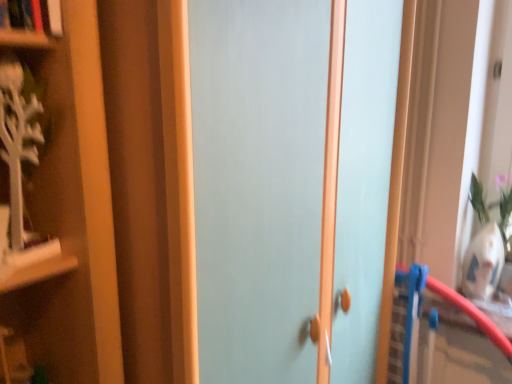
Question: From the image's perspective, is matte light blue door at center beneath hardcover book at upper left?

Choices:
 (A) no
 (B) yes

Answer: (B)

Question: Is matte light blue door at center to the left of hardcover book at upper left from the viewer's perspective?

Choices:
 (A) yes
 (B) no

Answer: (B)

Question: Is matte light blue door at center closer to the viewer compared to hardcover book at upper left?

Choices:
 (A) no
 (B) yes

Answer: (B)

Question: From a real-world perspective, is matte light blue door at center beneath hardcover book at upper left?

Choices:
 (A) yes
 (B) no

Answer: (A)

Question: Are matte light blue door at center and hardcover book at upper left beside each other?

Choices:
 (A) no
 (B) yes

Answer: (A)

Question: Does matte light blue door at center have a lesser height compared to hardcover book at upper left?

Choices:
 (A) no
 (B) yes

Answer: (A)

Question: Is hardcover book at upper left shorter than matte light blue door at center?

Choices:
 (A) no
 (B) yes

Answer: (B)

Question: Is hardcover book at upper left positioned behind matte light blue door at center?

Choices:
 (A) no
 (B) yes

Answer: (B)

Question: From the image's perspective, is hardcover book at upper left above matte light blue door at center?

Choices:
 (A) no
 (B) yes

Answer: (B)

Question: From a real-world perspective, is hardcover book at upper left over matte light blue door at center?

Choices:
 (A) no
 (B) yes

Answer: (B)

Question: From the image's perspective, is hardcover book at upper left under matte light blue door at center?

Choices:
 (A) yes
 (B) no

Answer: (B)

Question: Is hardcover book at upper left facing towards matte light blue door at center?

Choices:
 (A) no
 (B) yes

Answer: (A)

Question: From a real-world perspective, is matte light blue door at center physically located above or below hardcover book at upper left?

Choices:
 (A) above
 (B) below

Answer: (B)